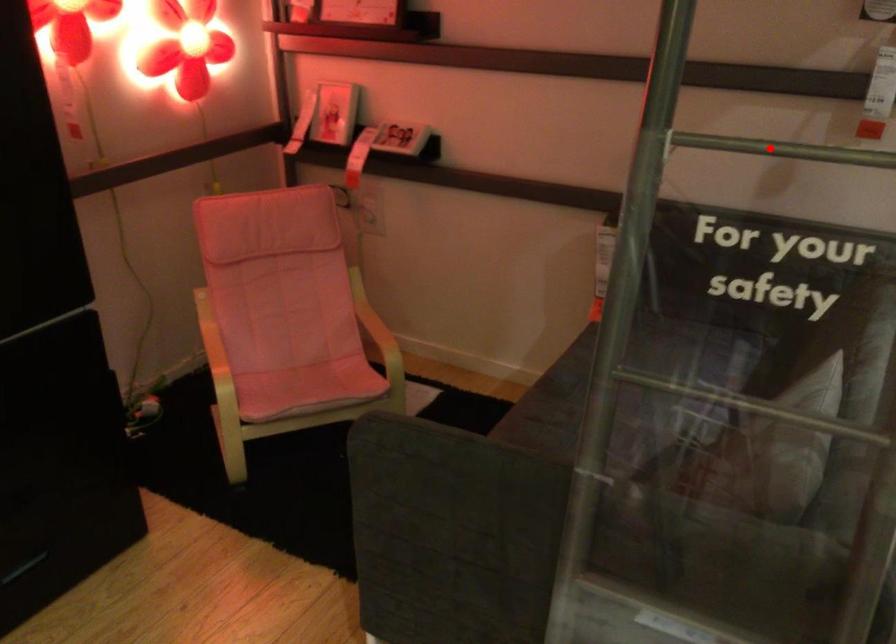
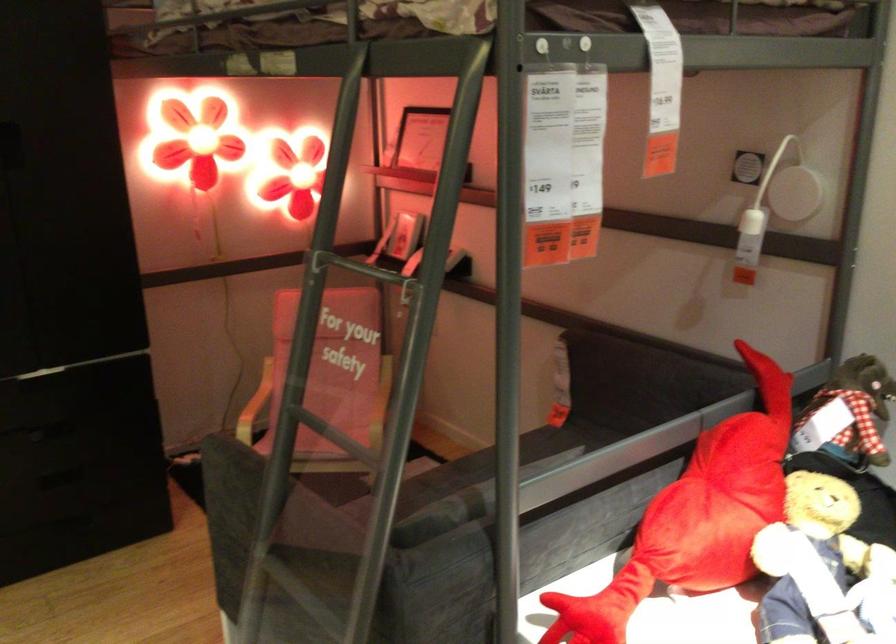
Question: I am providing you with two images of the same scene from different viewpoints. In image1, a red point is highlighted. Considering the same 3D point in image2, which of the following is correct?

Choices:
 (A) It is closer
 (B) It is farther

Answer: (B)